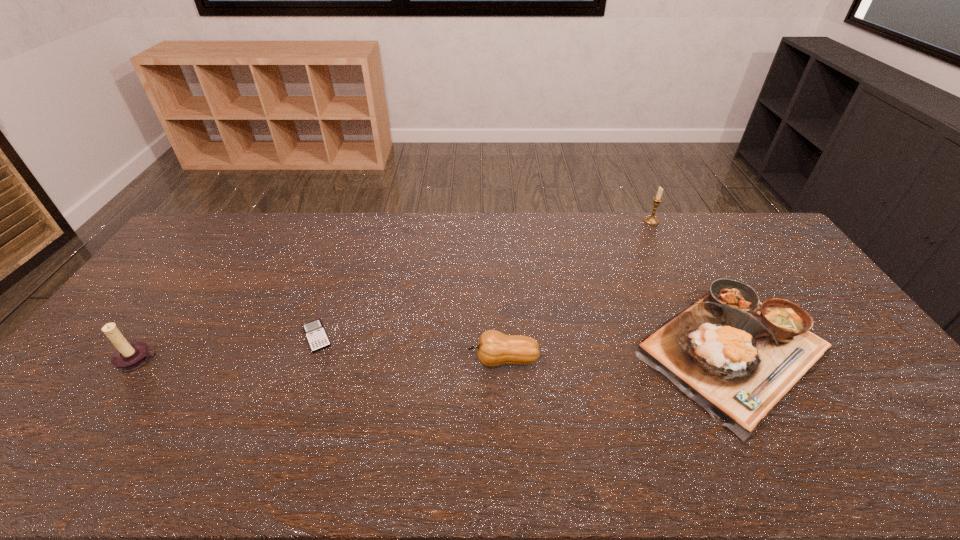
Locate an element on the screen. The height and width of the screenshot is (540, 960). free space at the far edge is located at coordinates coord(504,242).

Where is `vacant space at the near edge of the desktop`? The image size is (960, 540). vacant space at the near edge of the desktop is located at coordinates (344, 451).

At what (x,y) coordinates should I click in order to perform the action: click on vacant space at the left edge of the desktop. Please return your answer as a coordinate pair (x, y). The image size is (960, 540). Looking at the image, I should click on coord(205,257).

The width and height of the screenshot is (960, 540). Find the location of `free space at the right edge of the desktop`. free space at the right edge of the desktop is located at coordinates (769, 269).

Image resolution: width=960 pixels, height=540 pixels. Identify the location of vacant region at the far right corner. (730, 231).

Where is `free space between the farthest object and the shortest object`? This screenshot has width=960, height=540. free space between the farthest object and the shortest object is located at coordinates (484, 279).

You are a GUI agent. You are given a task and a screenshot of the screen. Output one action in this format:
    pyautogui.click(x=<x>, y=<y>)
    Task: Click on the vacant space in between the third object from right to left and the platter
    
    Given the screenshot: What is the action you would take?
    pyautogui.click(x=619, y=354)

This screenshot has height=540, width=960. Identify the location of unoccupied position between the platter and the leftmost object. (437, 355).

At what (x,y) coordinates should I click in order to perform the action: click on free space between the nearer candle holder and the calculator. Please return your answer as a coordinate pair (x, y). The image size is (960, 540). Looking at the image, I should click on click(x=228, y=348).

Locate an element on the screen. free space between the third object from right to left and the right candle holder is located at coordinates (577, 291).